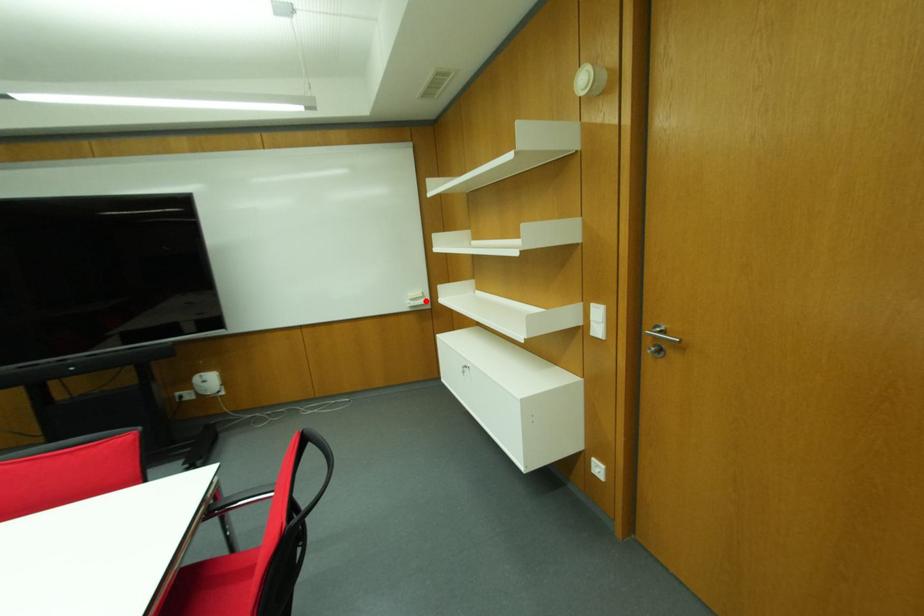
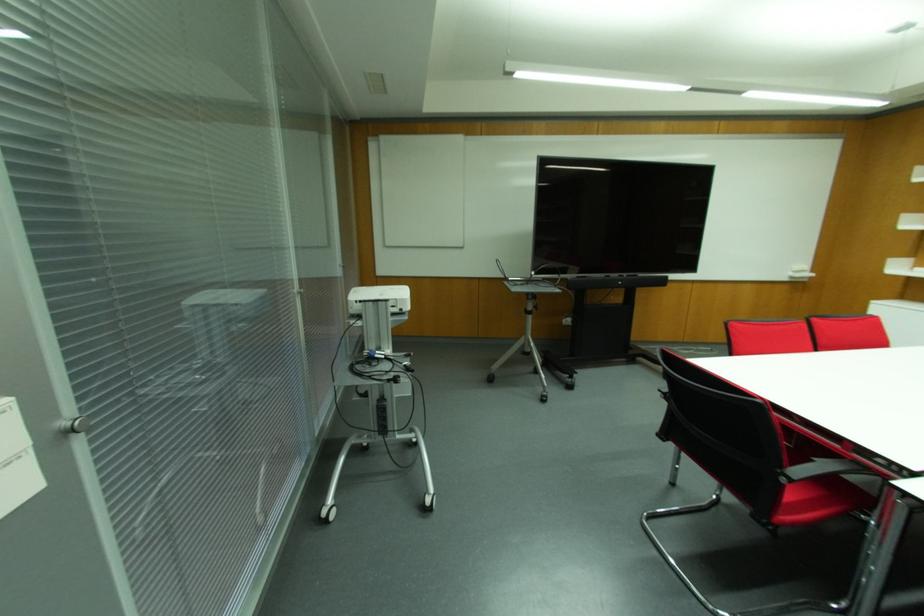
Locate, in the second image, the point that corresponds to the highlighted location in the first image.

(811, 274)